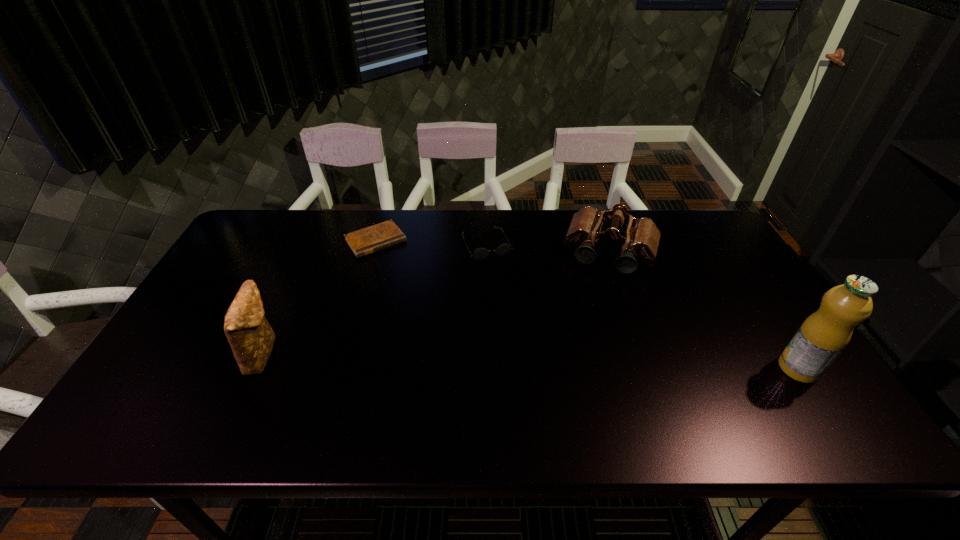
This screenshot has width=960, height=540. Identify the location of free spot on the desktop that is between the second tallest object and the fruit juice and is positioned on the front-facing side of the second shortest object. (545, 361).

Where is `free space on the desktop that is between the leftmost object and the fruit juice and is positioned on the spine side of the shortest object`? free space on the desktop that is between the leftmost object and the fruit juice and is positioned on the spine side of the shortest object is located at coordinates (464, 359).

Locate an element on the screen. This screenshot has width=960, height=540. vacant space on the desktop that is between the clutch bag and the rightmost object and is positioned through the eyepieces of the binoculars is located at coordinates (579, 362).